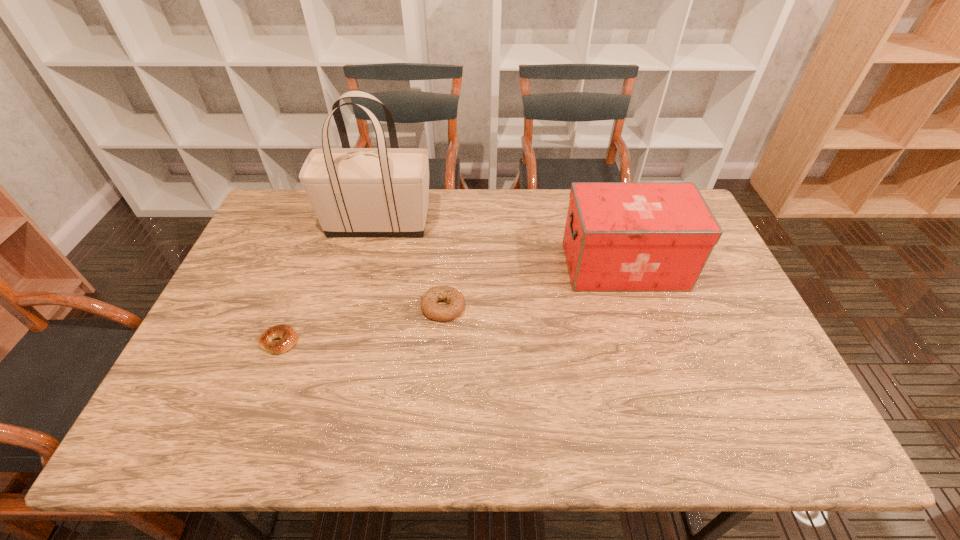
You are a GUI agent. You are given a task and a screenshot of the screen. Output one action in this format:
    pyautogui.click(x=<x>, y=<y>)
    Task: Click on the farthest object
    
    Given the screenshot: What is the action you would take?
    (x=355, y=192)

This screenshot has height=540, width=960. I want to click on the tallest object, so click(x=355, y=192).

Identify the location of the first-aid kit. (619, 236).

This screenshot has width=960, height=540. In order to click on the rightmost object in this screenshot , I will do `click(619, 236)`.

The image size is (960, 540). Find the location of `the second shortest object`. the second shortest object is located at coordinates coord(454,298).

The width and height of the screenshot is (960, 540). What are the coordinates of `the taller bagel` in the screenshot? It's located at (454, 298).

Image resolution: width=960 pixels, height=540 pixels. In order to click on the left bagel in this screenshot , I will do `click(288, 336)`.

Locate an element on the screen. the nearer bagel is located at coordinates (288, 336).

This screenshot has width=960, height=540. I want to click on free space located 0.100m with handles facing forward on the tallest object, so click(x=464, y=224).

You are a GUI agent. You are given a task and a screenshot of the screen. Output one action in this format:
    pyautogui.click(x=<x>, y=<y>)
    Task: Click on the vacant space located 0.100m on the handle side of the rightmost object
    
    Given the screenshot: What is the action you would take?
    pyautogui.click(x=531, y=266)